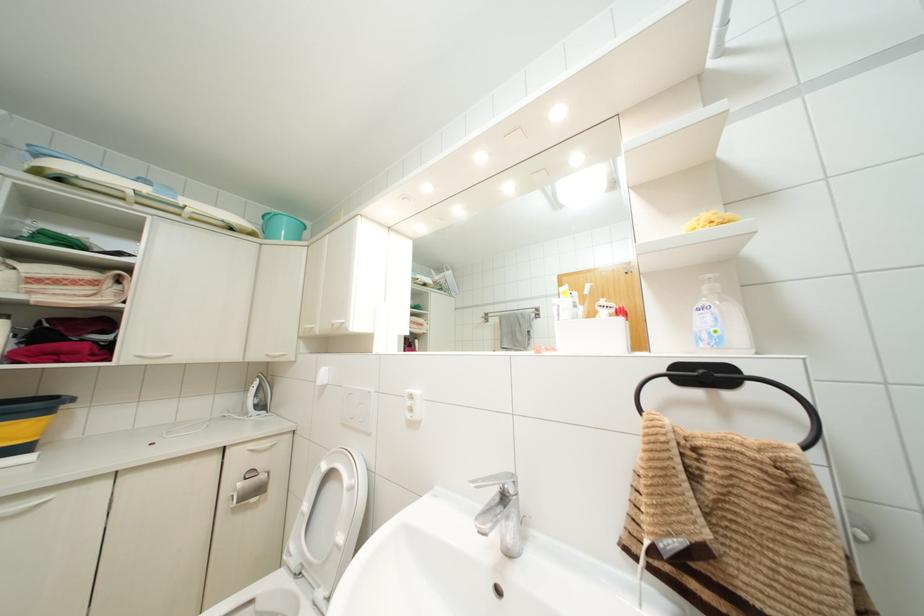
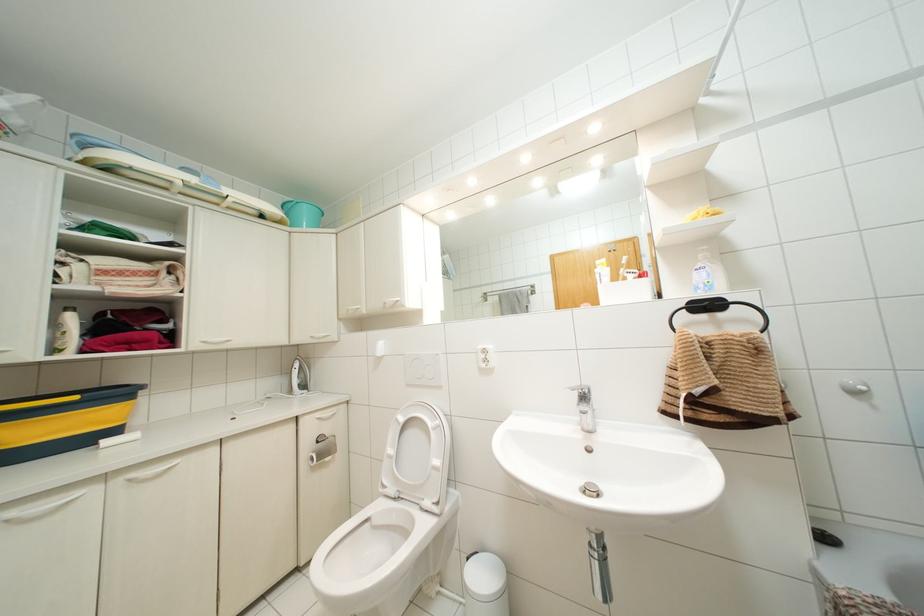
Which direction would the cameraman need to move to produce the second image?

The cameraman walked toward left, backward.